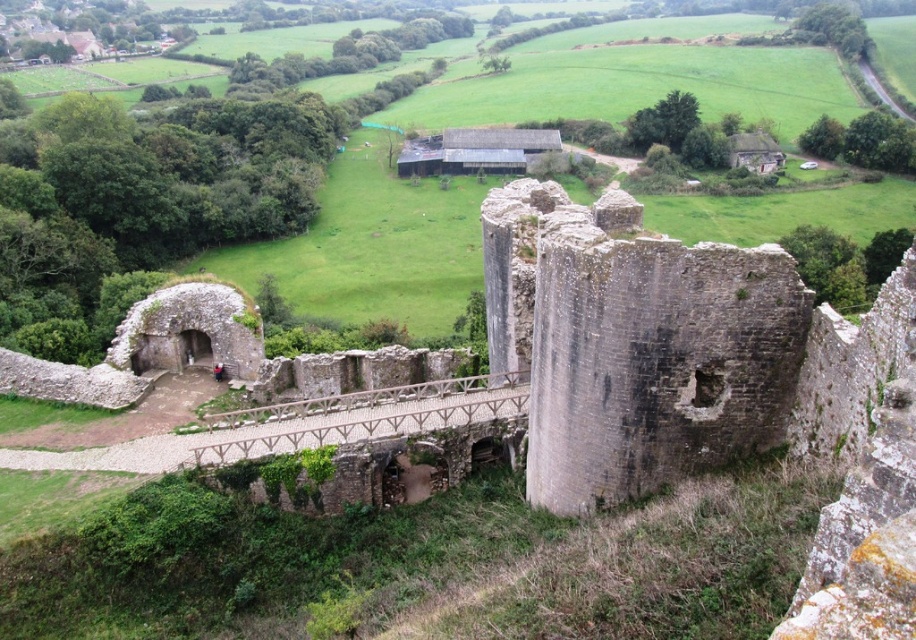
You are a tour guide leading a group across the medieval castle ruins. You need to inform your group about the distance between the gray stone ruins at center and the wooden bridge at center. What do you tell them?

The gray stone ruins at center and wooden bridge at center are 9.32 meters apart from each other.

You are an architect examining the medieval castle ruins. You need to determine if the gray stone ruins at center can support the weight of the wooden bridge at center. Based on their thickness, which structure is narrower and therefore potentially less stable?

The gray stone ruins at center is thinner than wooden bridge at center, so the gray stone ruins at center is narrower and potentially less stable.